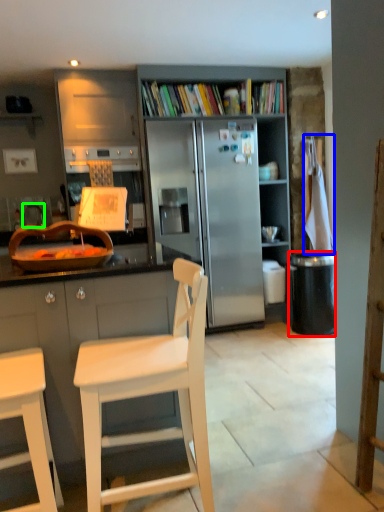
Question: Which object is positioned farthest from trash bin/can (highlighted by a red box)? Select from towel/napkin (highlighted by a blue box) and faucet (highlighted by a green box).

Choices:
 (A) towel/napkin
 (B) faucet

Answer: (B)